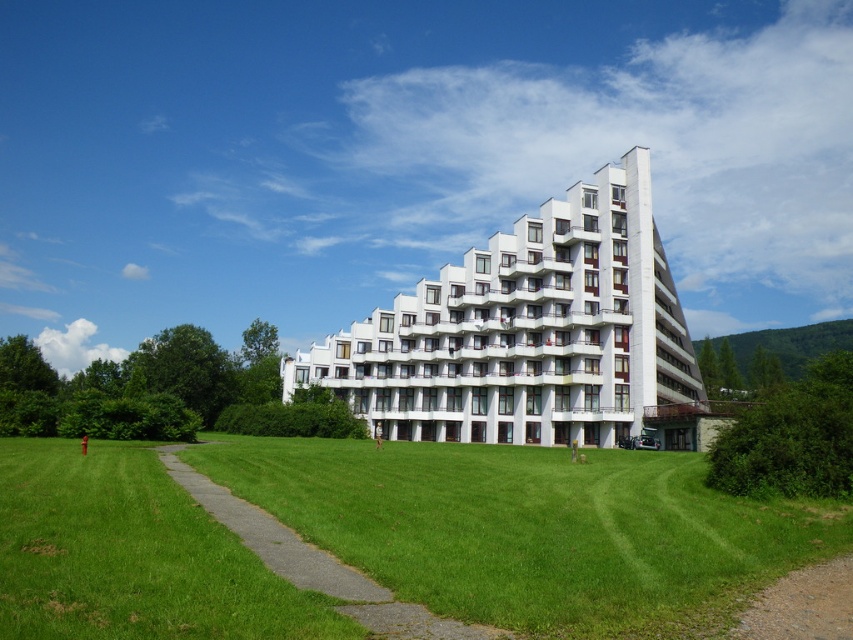
Is white smooth building at center bigger than green grass at center?

Correct, white smooth building at center is larger in size than green grass at center.

Does white smooth building at center appear on the right side of green grass at center?

Correct, you'll find white smooth building at center to the right of green grass at center.

I want to click on white smooth building at center, so click(x=526, y=332).